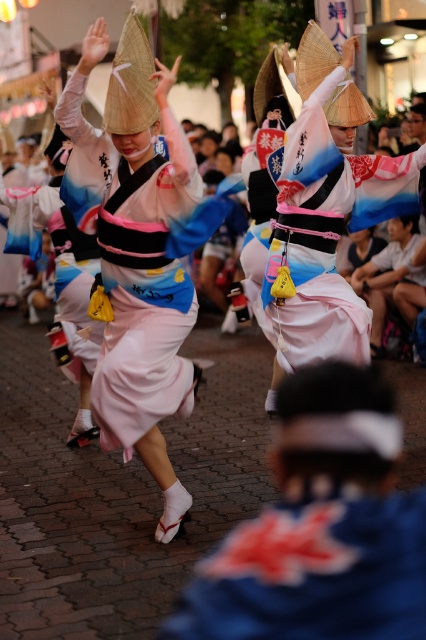
You are a photographer at the festival and want to capture both the blue silk kimono at center and the matte pink kimono at center in a single shot. Which kimono is positioned lower in the frame?

The blue silk kimono at center is located below the matte pink kimono at center, so it is positioned lower in the frame.

Consider the image. You are a photographer trying to capture the perfect shot of the blue silk kimono at center during the festival. Given the coordinates provided, where should you position your camera to ensure the kimono is centered in your frame?

The blue silk kimono at center is located at coordinates point (313, 572). To center it in your frame, position your camera so that the crosshairs align with those coordinates.

You are a photographer at the festival and want to capture both performers in a single frame. Since the blue silk kimono at center is shorter than the matte pink kimono at center, what adjustment should you make to ensure both are fully visible?

To ensure both the blue silk kimono at center and the matte pink kimono at center are fully visible in the frame, you should lower your camera angle slightly since the blue silk kimono at center is shorter than the matte pink kimono at center. This adjustment will allow the shorter performer in the blue silk kimono at center to be captured without cropping the top of their kimono while still including the taller matte pink kimono at center in the shot.